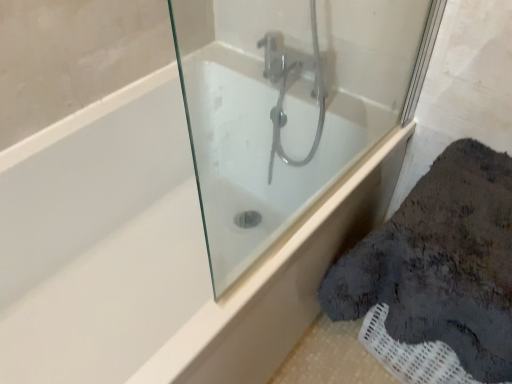
Question: Considering the relative sizes of white glossy bathtub at center and white glossy bathtub at center in the image provided, is white glossy bathtub at center wider than white glossy bathtub at center?

Choices:
 (A) no
 (B) yes

Answer: (A)

Question: Does white glossy bathtub at center come behind white glossy bathtub at center?

Choices:
 (A) yes
 (B) no

Answer: (B)

Question: Is white glossy bathtub at center positioned in front of white glossy bathtub at center?

Choices:
 (A) yes
 (B) no

Answer: (A)

Question: From a real-world perspective, is white glossy bathtub at center on white glossy bathtub at center?

Choices:
 (A) no
 (B) yes

Answer: (B)

Question: From the image's perspective, is white glossy bathtub at center on white glossy bathtub at center?

Choices:
 (A) yes
 (B) no

Answer: (A)

Question: From a real-world perspective, is white glossy bathtub at center located beneath white glossy bathtub at center?

Choices:
 (A) yes
 (B) no

Answer: (B)

Question: Is white glossy bathtub at center far from white glossy bathtub at center?

Choices:
 (A) yes
 (B) no

Answer: (B)

Question: Is white glossy bathtub at center facing away from white glossy bathtub at center?

Choices:
 (A) yes
 (B) no

Answer: (B)

Question: Is white glossy bathtub at center touching white glossy bathtub at center?

Choices:
 (A) yes
 (B) no

Answer: (B)

Question: Does white glossy bathtub at center have a smaller size compared to white glossy bathtub at center?

Choices:
 (A) no
 (B) yes

Answer: (A)

Question: Is white glossy bathtub at center at the left side of white glossy bathtub at center?

Choices:
 (A) yes
 (B) no

Answer: (A)

Question: Does white glossy bathtub at center have a greater width compared to white glossy bathtub at center?

Choices:
 (A) yes
 (B) no

Answer: (A)

Question: Relative to white glossy bathtub at center, is white glossy bathtub at center in front or behind?

Choices:
 (A) behind
 (B) front

Answer: (B)